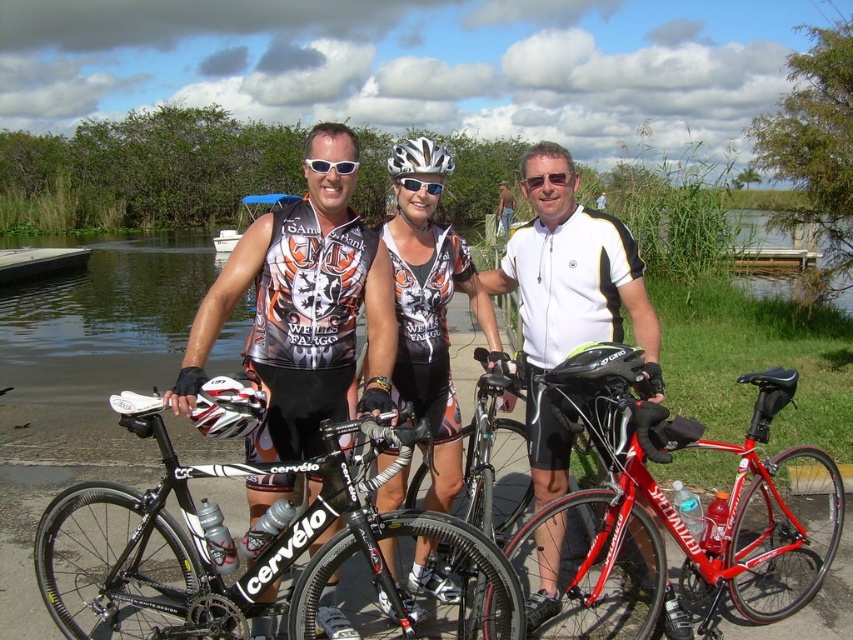
Is point (706, 291) closer to camera compared to point (343, 170)?

No, (706, 291) is behind (343, 170).

Where is `green grass at lower center`? This screenshot has height=640, width=853. green grass at lower center is located at coordinates (103, 317).

Who is more distant from viewer, (91, 380) or (328, 170)?

Positioned behind is point (91, 380).

Identify the location of green grass at lower center. Image resolution: width=853 pixels, height=640 pixels. (103, 317).

Is point (120, 275) in front of point (430, 147)?

No.

Is green grass at lower center above white matte bicycle helmet at center?

Incorrect, green grass at lower center is not positioned above white matte bicycle helmet at center.

Does point (753, 225) lie in front of point (393, 164)?

That is False.

Where is `green grass at lower center`? The image size is (853, 640). green grass at lower center is located at coordinates (103, 317).

Is white matte bicycle helmet at center positioned behind white matte goggles at center?

Yes, white matte bicycle helmet at center is behind white matte goggles at center.

Can you confirm if white matte bicycle helmet at center is bigger than white matte goggles at center?

Yes.

Which is in front, point (428, 164) or point (440, 189)?

Point (428, 164)

This screenshot has width=853, height=640. Identify the location of white matte bicycle helmet at center. (419, 157).